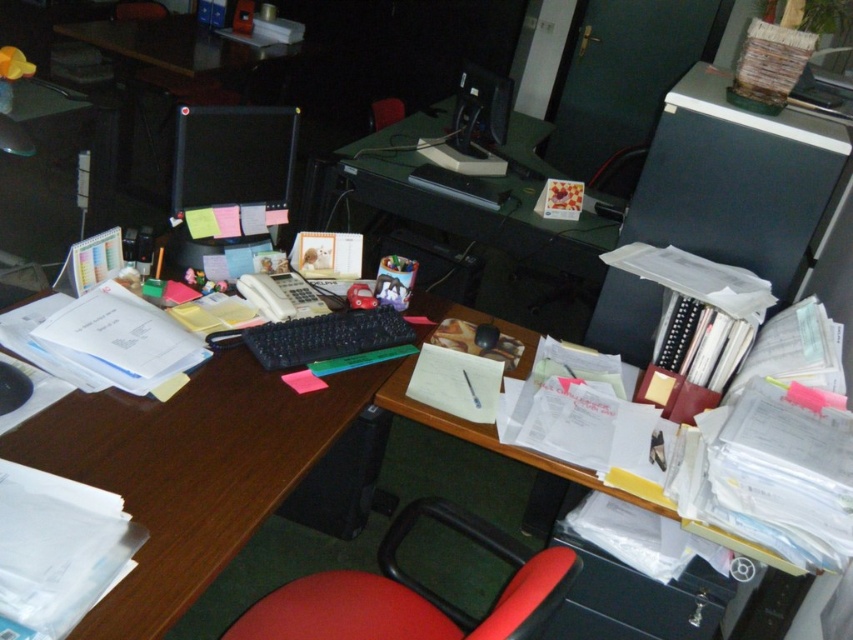
Question: Which is farther from the wooden desk at left?

Choices:
 (A) black plastic file cabinet at right
 (B) red fabric swivel chair at lower center
 (C) matte black monitor at upper center

Answer: (C)

Question: Does black plastic file cabinet at right have a larger size compared to black glossy monitor at upper center?

Choices:
 (A) yes
 (B) no

Answer: (A)

Question: Considering the real-world distances, which object is closest to the matte black monitor at upper center?

Choices:
 (A) red fabric swivel chair at lower center
 (B) wooden desk at left
 (C) black glossy monitor at upper center

Answer: (C)

Question: Among these points, which one is nearest to the camera?

Choices:
 (A) (654, 150)
 (B) (509, 97)
 (C) (351, 378)
 (D) (469, 531)

Answer: (D)

Question: Is black plastic file cabinet at right wider than matte black monitor at upper center?

Choices:
 (A) yes
 (B) no

Answer: (A)

Question: Does wooden desk at left have a lesser width compared to black plastic file cabinet at right?

Choices:
 (A) yes
 (B) no

Answer: (B)